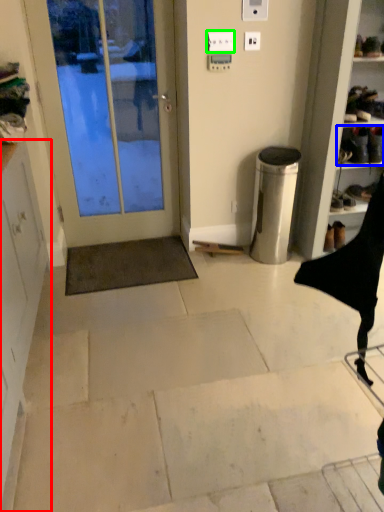
Question: Which object is the farthest from cabinetry (highlighted by a red box)? Choose among these: footwear (highlighted by a blue box) or electric outlet (highlighted by a green box).

Choices:
 (A) footwear
 (B) electric outlet

Answer: (A)